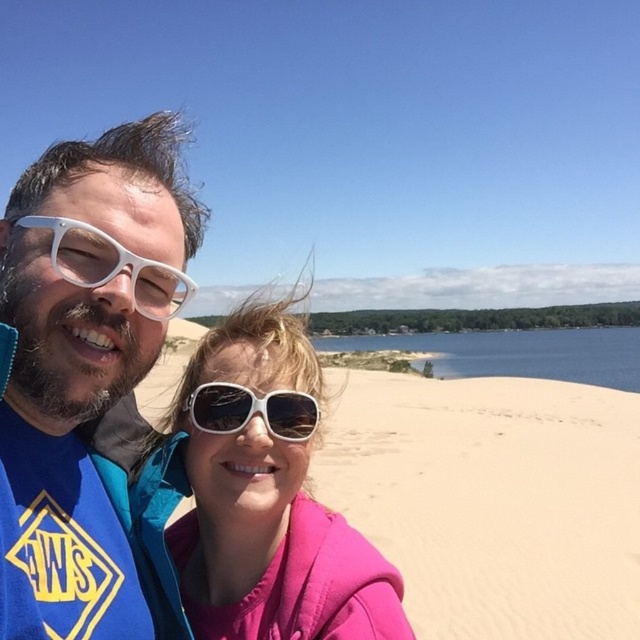
Which is in front, point (419, 449) or point (147, 305)?

Point (147, 305) is in front.

Is point (584, 598) farther from viewer compared to point (136, 301)?

Yes, point (584, 598) is farther from viewer.

This screenshot has width=640, height=640. Identify the location of sandy yellow sand at center. (492, 499).

Who is more distant from viewer, (355, 516) or (243, 568)?

The point (355, 516) is more distant.

Between sandy yellow sand at center and pink matte jacket at center, which one has more height?

sandy yellow sand at center is taller.

Who is more distant from viewer, (x=356, y=388) or (x=266, y=410)?

Point (x=356, y=388)

Identify the location of sandy yellow sand at center. (492, 499).

Who is more forward, (33, 301) or (284, 429)?

Positioned in front is point (33, 301).

Does white matte sunglasses at upper left have a larger size compared to white matte sunglasses at center?

Correct, white matte sunglasses at upper left is larger in size than white matte sunglasses at center.

Is point (180, 218) positioned after point (236, 417)?

Yes, it is.

Where is `white matte sunglasses at upper left`? white matte sunglasses at upper left is located at coordinates (90, 385).